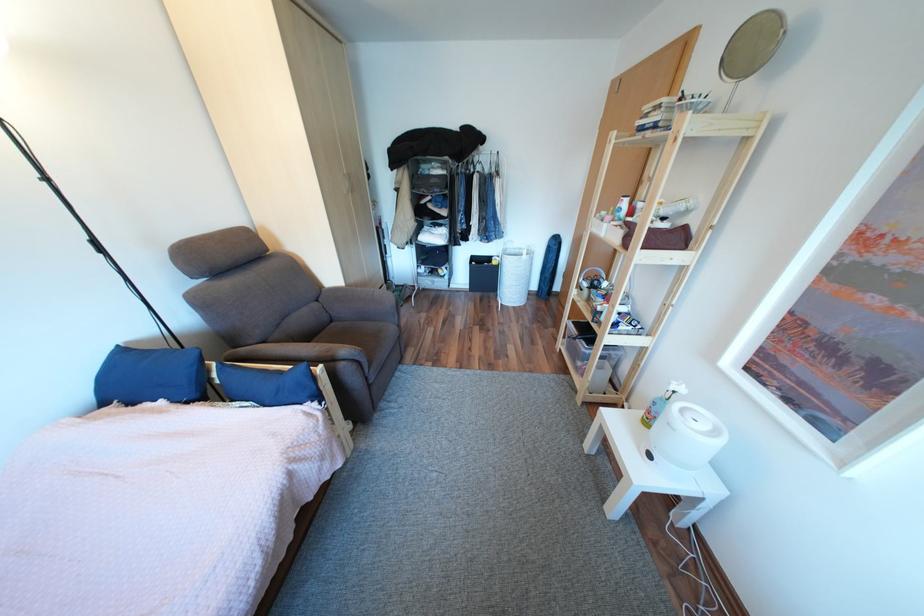
Identify the location of gray recliner armrest. (359, 304).